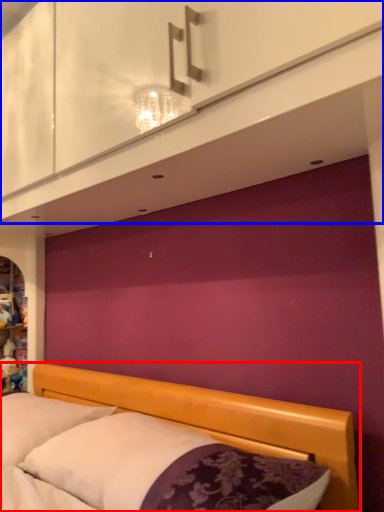
Question: Which of the following is the closest to the observer, bed (highlighted by a red box) or dresser (highlighted by a blue box)?

Choices:
 (A) bed
 (B) dresser

Answer: (A)